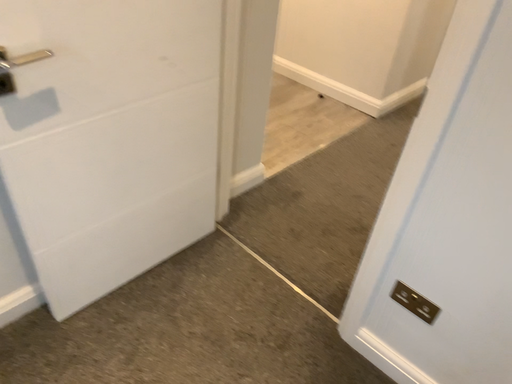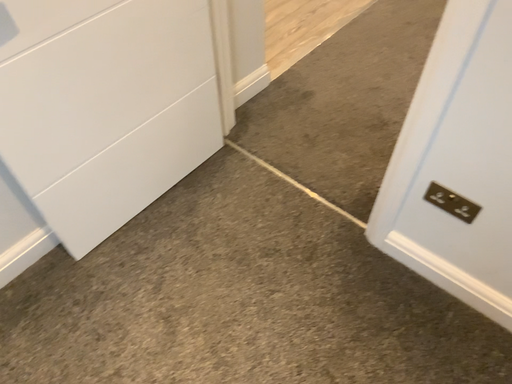
Question: How did the camera likely rotate when shooting the video?

Choices:
 (A) rotated downward
 (B) rotated upward

Answer: (A)